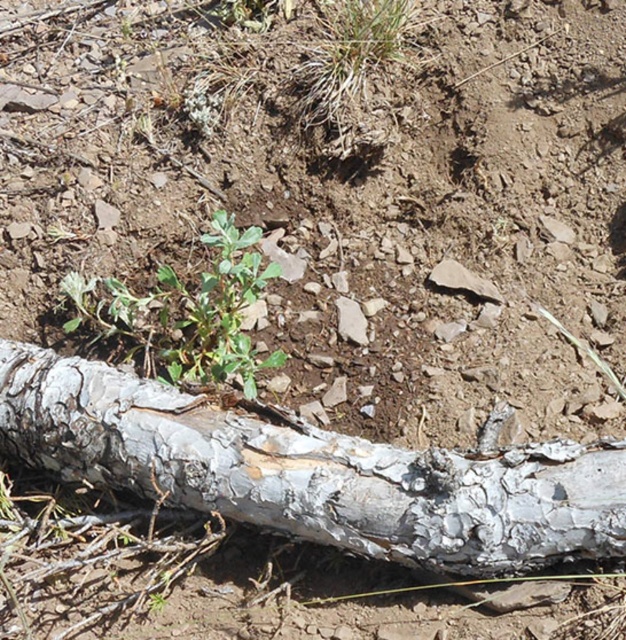
You are an explorer who needs to step over the gray rough bark log at center to reach the green leafy plant at center. Can you easily step over the log?

The gray rough bark log at center is closer to the viewer than the green leafy plant at center, so you can easily step over the log to reach the plant.

You are standing at the center of the image and want to place a small marker exactly at the position of the gray rough bark log at center. What are the coordinates where you should place the marker?

The coordinates for the gray rough bark log at center are at point (x=314, y=472), so you should place the marker there.